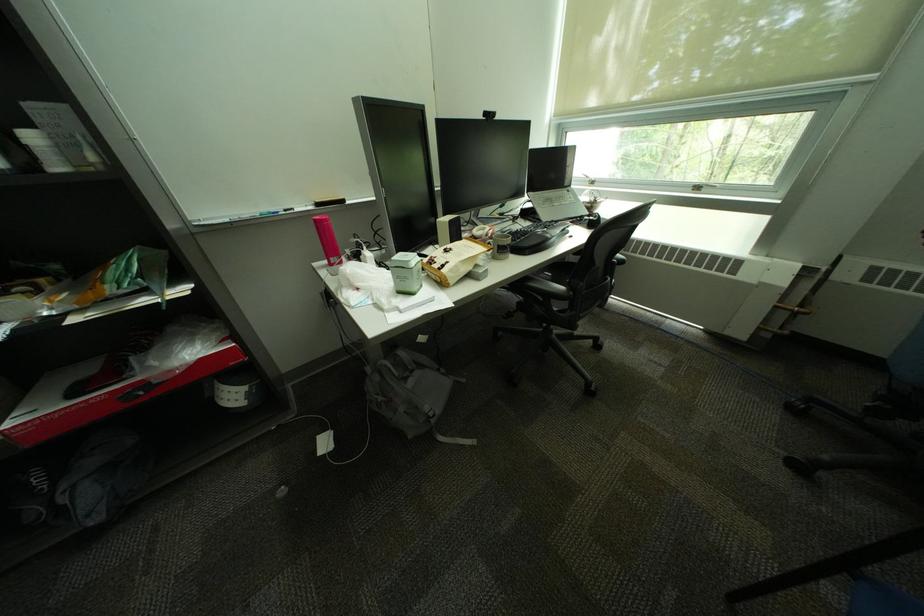
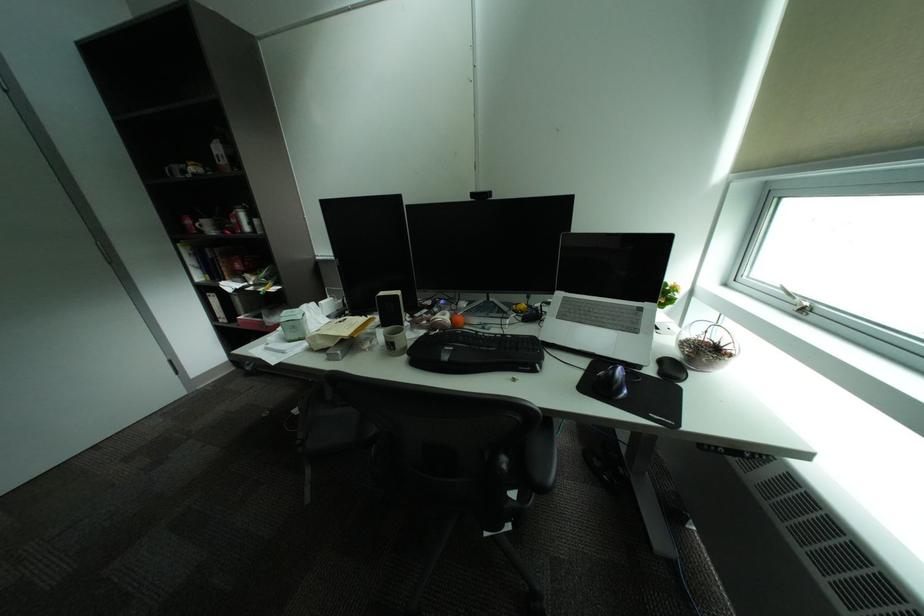
Where in the second image is the point corresponding to (180,373) from the first image?

(281, 323)